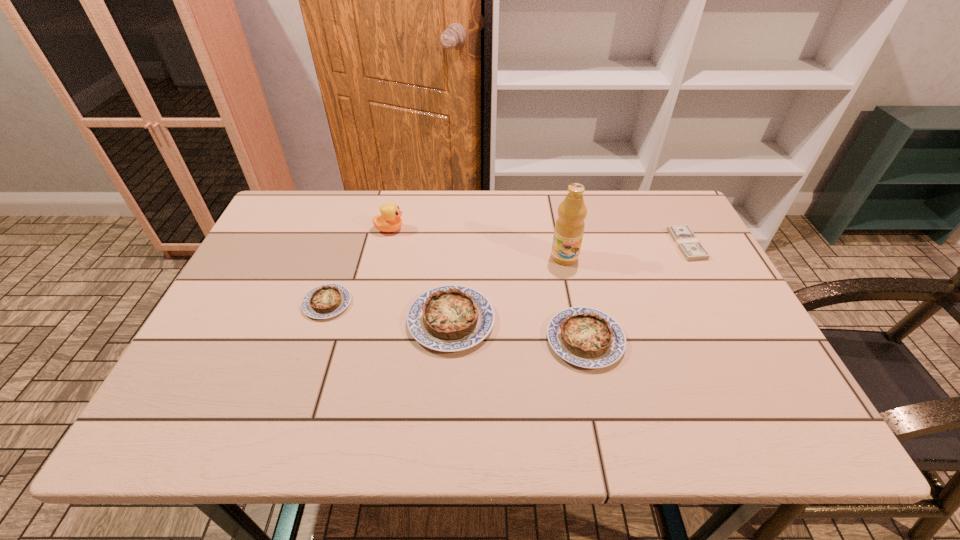
Where is `object present at the far right corner`? This screenshot has height=540, width=960. object present at the far right corner is located at coordinates point(691,248).

Locate an element on the screen. Image resolution: width=960 pixels, height=540 pixels. blank space at the far edge is located at coordinates (520, 211).

The image size is (960, 540). In the image, there is a desktop. Identify the location of vacant space at the near edge. (508, 390).

Image resolution: width=960 pixels, height=540 pixels. In the image, there is a desktop. What are the coordinates of `vacant space at the left edge` in the screenshot? It's located at (262, 256).

Where is `vacant space at the right edge`? This screenshot has height=540, width=960. vacant space at the right edge is located at coordinates (658, 271).

In the image, there is a desktop. Where is `vacant space at the far left corner`? The image size is (960, 540). vacant space at the far left corner is located at coordinates (283, 236).

Image resolution: width=960 pixels, height=540 pixels. I want to click on vacant space at the far right corner, so click(678, 204).

The width and height of the screenshot is (960, 540). In order to click on free point between the leftmost quiche and the second quiche from right to left in this screenshot , I will do `click(389, 312)`.

Find the location of `vacant space that is in between the rightmost object and the second quiche from left to right`. vacant space that is in between the rightmost object and the second quiche from left to right is located at coordinates (569, 282).

At what (x,y) coordinates should I click in order to perform the action: click on free point between the fourth object from right to left and the duckling. Please return your answer as a coordinate pair (x, y). This screenshot has width=960, height=540. Looking at the image, I should click on [420, 275].